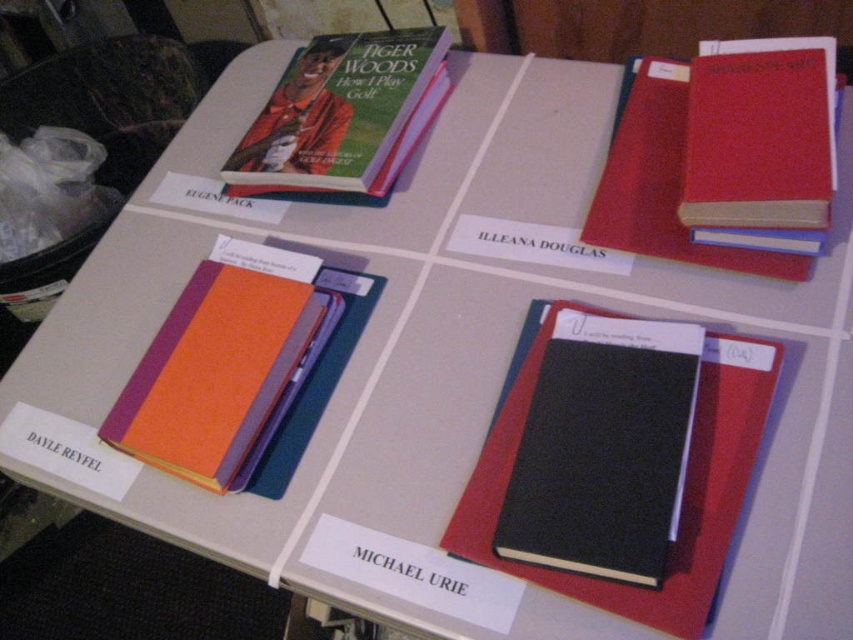
You are looking at the table with two points marked on it. The first point is at coordinates point (178, 404) and the second is at point (392, 170). Which point is closer to you?

Point (178, 404) is closer to the camera than point (392, 170).

You are organizing a library and need to place the orange fabric binder at lower left and the matte red book at upper right on a shelf. According to the image, which object is positioned to the left of the other?

The orange fabric binder at lower left is positioned to the left of the matte red book at upper right.